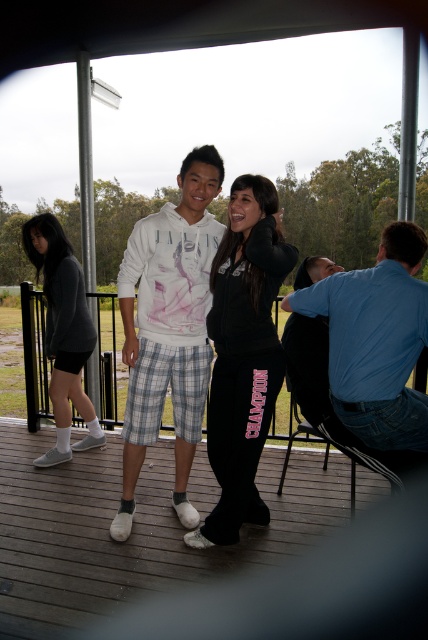
The image size is (428, 640). What do you see at coordinates (133, 531) in the screenshot? I see `black fabric deck at center` at bounding box center [133, 531].

Does black fabric deck at center appear under blue cotton shirt at right?

Yes, black fabric deck at center is below blue cotton shirt at right.

Who is more distant from viewer, (x=201, y=456) or (x=357, y=410)?

The point (x=201, y=456) is more distant.

Where is `black fabric deck at center`? black fabric deck at center is located at coordinates (133, 531).

Between white cotton hoodie at center and blue cotton shirt at right, which one has more height?

With more height is white cotton hoodie at center.

Which is below, white cotton hoodie at center or blue cotton shirt at right?

white cotton hoodie at center is below.

The height and width of the screenshot is (640, 428). I want to click on white cotton hoodie at center, so click(169, 328).

Image resolution: width=428 pixels, height=640 pixels. What are the coordinates of `white cotton hoodie at center` in the screenshot? It's located at (169, 328).

Which is in front, point (62, 284) or point (294, 317)?

Point (294, 317) is in front.

Which is more to the right, matte gray hoodie at left or metallic blue chair at right?

From the viewer's perspective, metallic blue chair at right appears more on the right side.

Between point (97, 445) and point (308, 376), which one is positioned behind?

Point (97, 445)

In order to click on matte gray hoodie at left in this screenshot , I will do `click(64, 333)`.